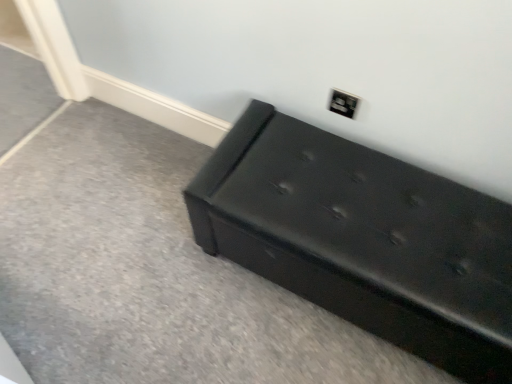
Describe the element at coordinates (343, 103) in the screenshot. I see `matte black outlet at upper right` at that location.

Locate an element on the screen. This screenshot has width=512, height=384. matte black outlet at upper right is located at coordinates click(x=343, y=103).

The width and height of the screenshot is (512, 384). Describe the element at coordinates (362, 239) in the screenshot. I see `black leather bench at lower right` at that location.

This screenshot has width=512, height=384. I want to click on black leather bench at lower right, so click(362, 239).

Locate an element on the screen. The height and width of the screenshot is (384, 512). matte black outlet at upper right is located at coordinates (343, 103).

Between matte black outlet at upper right and black leather bench at lower right, which one appears on the left side from the viewer's perspective?

Positioned to the left is matte black outlet at upper right.

Is matte black outlet at upper right closer to camera compared to black leather bench at lower right?

No, it is behind black leather bench at lower right.

Is point (349, 104) farther from viewer compared to point (244, 234)?

Yes, it is.

From the image's perspective, which is above, matte black outlet at upper right or black leather bench at lower right?

From the image's view, matte black outlet at upper right is above.

From a real-world perspective, which object stands above the other?

In real-world perspective, matte black outlet at upper right is above.

Which object is thinner, matte black outlet at upper right or black leather bench at lower right?

matte black outlet at upper right is thinner.

Between matte black outlet at upper right and black leather bench at lower right, which one has less height?

Standing shorter between the two is matte black outlet at upper right.

Who is bigger, matte black outlet at upper right or black leather bench at lower right?

Bigger between the two is black leather bench at lower right.

Is matte black outlet at upper right positioned beyond the bounds of black leather bench at lower right?

Yes.

Does matte black outlet at upper right touch black leather bench at lower right?

No, matte black outlet at upper right is not next to black leather bench at lower right.

Is matte black outlet at upper right positioned with its back to black leather bench at lower right?

No.

In order to click on electric outlet on the left of black leather bench at lower right in this screenshot , I will do `click(343, 103)`.

Can you confirm if black leather bench at lower right is positioned to the right of matte black outlet at upper right?

Correct, you'll find black leather bench at lower right to the right of matte black outlet at upper right.

Is black leather bench at lower right in front of or behind matte black outlet at upper right in the image?

Clearly, black leather bench at lower right is in front of matte black outlet at upper right.

Is point (424, 355) more distant than point (344, 99)?

That is False.

From the image's perspective, is black leather bench at lower right below matte black outlet at upper right?

Yes.

From a real-world perspective, is black leather bench at lower right physically located above or below matte black outlet at upper right?

In terms of real-world spatial position, black leather bench at lower right is below matte black outlet at upper right.

Between black leather bench at lower right and matte black outlet at upper right, which one has larger width?

black leather bench at lower right is wider.

Considering the relative sizes of black leather bench at lower right and matte black outlet at upper right in the image provided, is black leather bench at lower right taller than matte black outlet at upper right?

Yes, black leather bench at lower right is taller than matte black outlet at upper right.

Considering the relative sizes of black leather bench at lower right and matte black outlet at upper right in the image provided, is black leather bench at lower right smaller than matte black outlet at upper right?

Actually, black leather bench at lower right might be larger than matte black outlet at upper right.

Do you think black leather bench at lower right is within matte black outlet at upper right, or outside of it?

black leather bench at lower right is not inside matte black outlet at upper right, it's outside.

Consider the image. Is there a large distance between black leather bench at lower right and matte black outlet at upper right?

No.

Is black leather bench at lower right oriented towards matte black outlet at upper right?

No, black leather bench at lower right does not turn towards matte black outlet at upper right.

Measure the distance between black leather bench at lower right and matte black outlet at upper right.

The distance of black leather bench at lower right from matte black outlet at upper right is 16.87 inches.

You are a GUI agent. You are given a task and a screenshot of the screen. Output one action in this format:
    pyautogui.click(x=<x>, y=<y>)
    Task: Click on the furniture that is in front of the matte black outlet at upper right
    
    Given the screenshot: What is the action you would take?
    pyautogui.click(x=362, y=239)

The width and height of the screenshot is (512, 384). In order to click on furniture below the matte black outlet at upper right (from the image's perspective) in this screenshot , I will do `click(362, 239)`.

Image resolution: width=512 pixels, height=384 pixels. What are the coordinates of `furniture in front of the matte black outlet at upper right` in the screenshot? It's located at (362, 239).